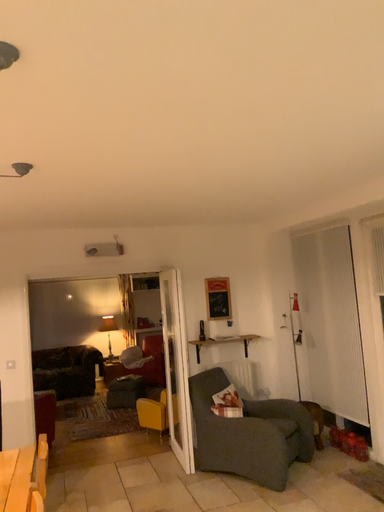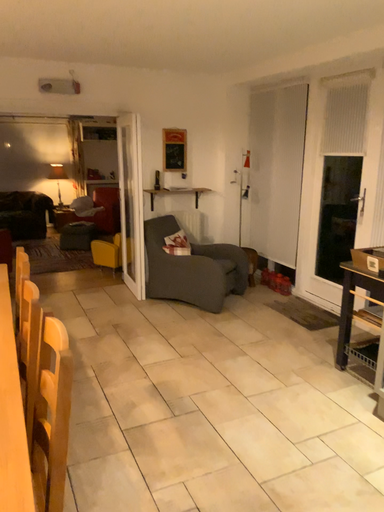
Question: Which way did the camera rotate in the video?

Choices:
 (A) rotated left
 (B) rotated right

Answer: (B)